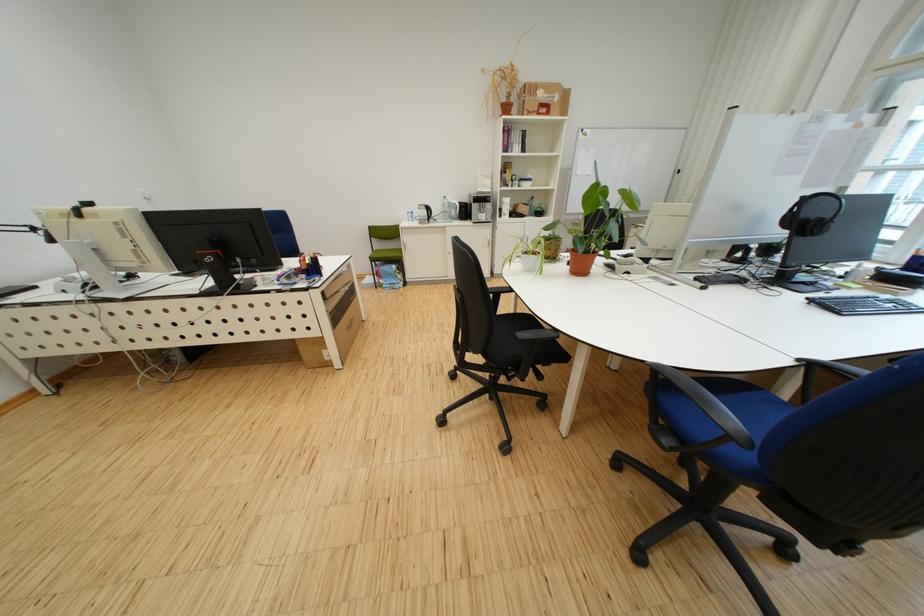
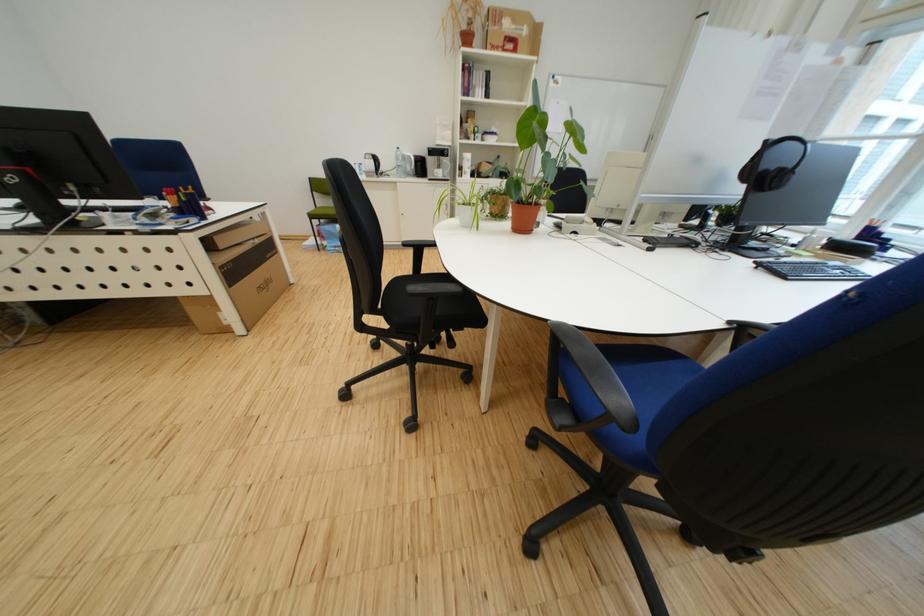
Locate, in the second image, the point that corresponds to (x=622, y=432) in the first image.

(548, 408)